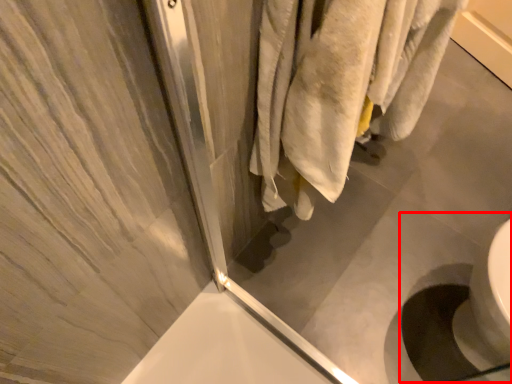
Question: From the image's perspective, what is the correct spatial relationship of sink (annotated by the red box) in relation to screen door?

Choices:
 (A) below
 (B) above

Answer: (A)